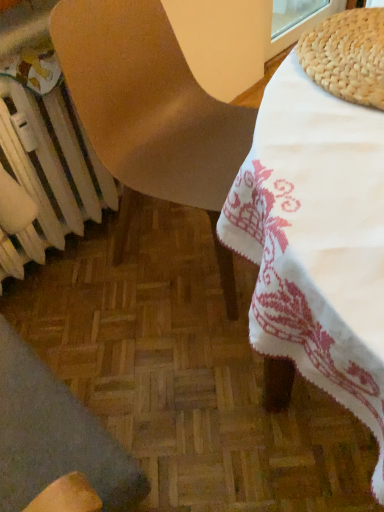
Question: Is wooden chair at lower left, acting as the second chair starting from the top, situated inside white metallic radiator at lower left or outside?

Choices:
 (A) inside
 (B) outside

Answer: (B)

Question: From the image's perspective, relative to white metallic radiator at lower left, is wooden chair at lower left, acting as the second chair starting from the top, above or below?

Choices:
 (A) below
 (B) above

Answer: (A)

Question: Considering the real-world distances, which object is farthest from the white metallic radiator at lower left?

Choices:
 (A) wooden chair at lower left, which appears as the first chair when ordered from the bottom
 (B) matte brown chair at center, which is the 2th chair from bottom to top

Answer: (A)

Question: Estimate the real-world distances between objects in this image. Which object is closer to the wooden chair at lower left, which appears as the first chair when ordered from the bottom?

Choices:
 (A) white metallic radiator at lower left
 (B) matte brown chair at center, marked as the 1th chair in a top-to-bottom arrangement

Answer: (A)